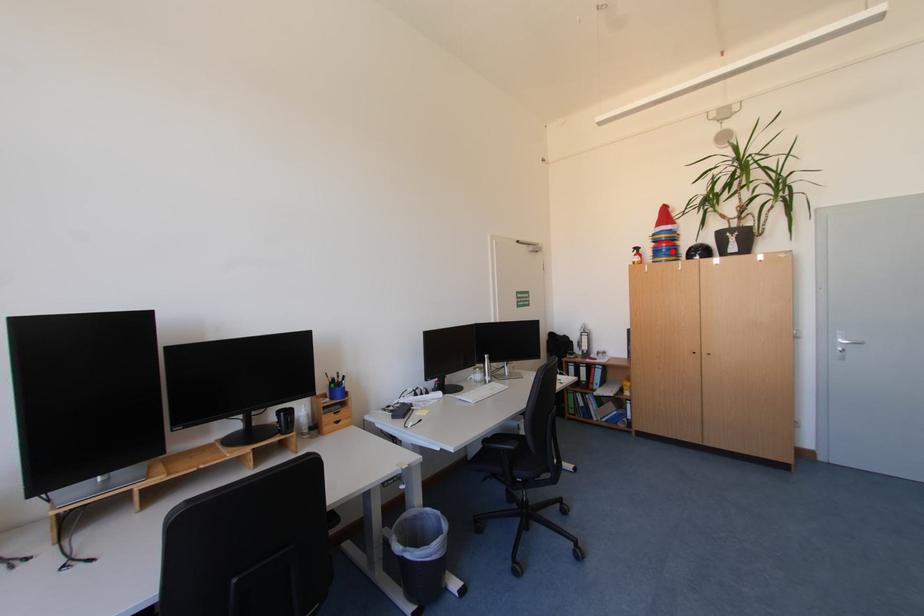
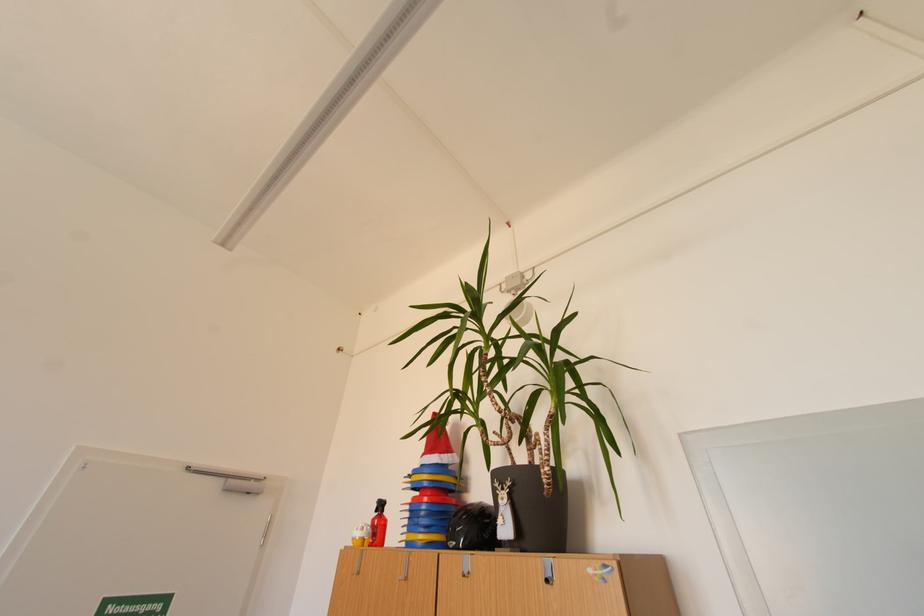
In the second image, find the point that corresponds to the highlighted location in the first image.

(431, 514)